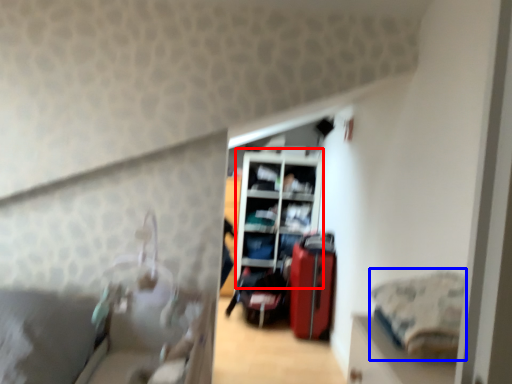
Question: Which object is further to the camera taking this photo, locker (highlighted by a red box) or bedding (highlighted by a blue box)?

Choices:
 (A) locker
 (B) bedding

Answer: (A)